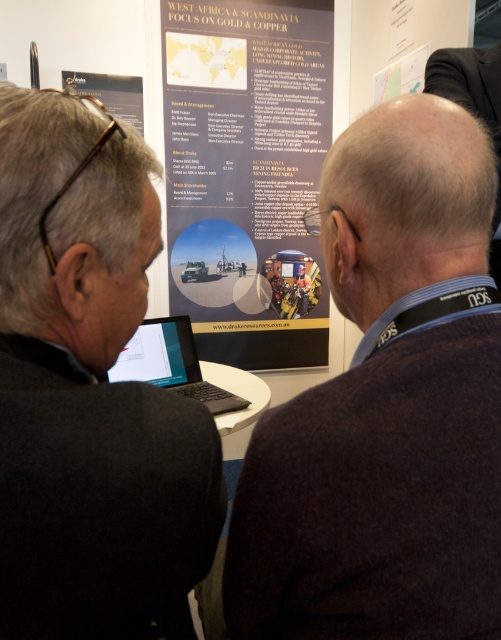
Question: Which point appears farthest from the camera in this image?

Choices:
 (A) (139, 344)
 (B) (186, 356)
 (C) (289, 120)
 (D) (67, 444)

Answer: (C)

Question: Does dark brown wool coat at center lie behind matte black laptop at center?

Choices:
 (A) yes
 (B) no

Answer: (B)

Question: Which of the following is the farthest from the observer?

Choices:
 (A) black matte suit at left
 (B) black matte laptop at center
 (C) matte gold poster at center

Answer: (C)

Question: Does dark brown wool coat at center have a greater width compared to matte black laptop at center?

Choices:
 (A) yes
 (B) no

Answer: (B)

Question: Which of the following is the farthest from the observer?

Choices:
 (A) dark brown wool coat at center
 (B) black matte laptop at center

Answer: (B)

Question: Is matte gold poster at center in front of black matte laptop at center?

Choices:
 (A) no
 (B) yes

Answer: (A)